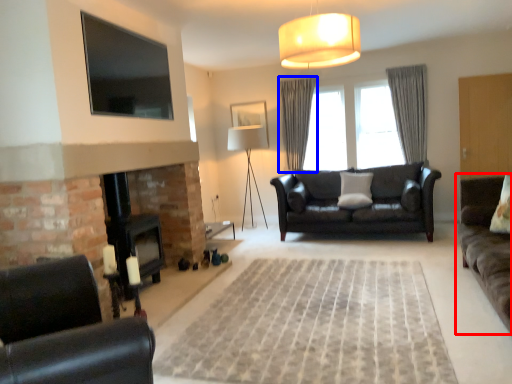
Question: Among these objects, which one is farthest to the camera, studio couch (highlighted by a red box) or curtain (highlighted by a blue box)?

Choices:
 (A) studio couch
 (B) curtain

Answer: (B)